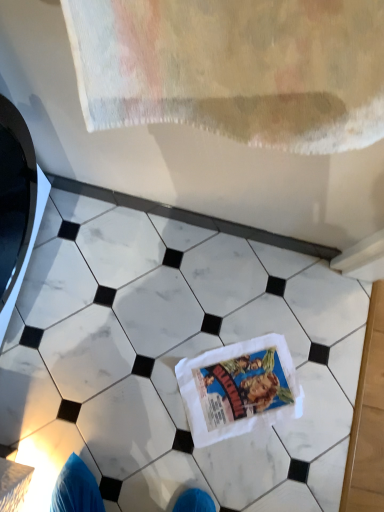
The image size is (384, 512). I want to click on vacant space behind white cotton comic book at center, so click(x=259, y=298).